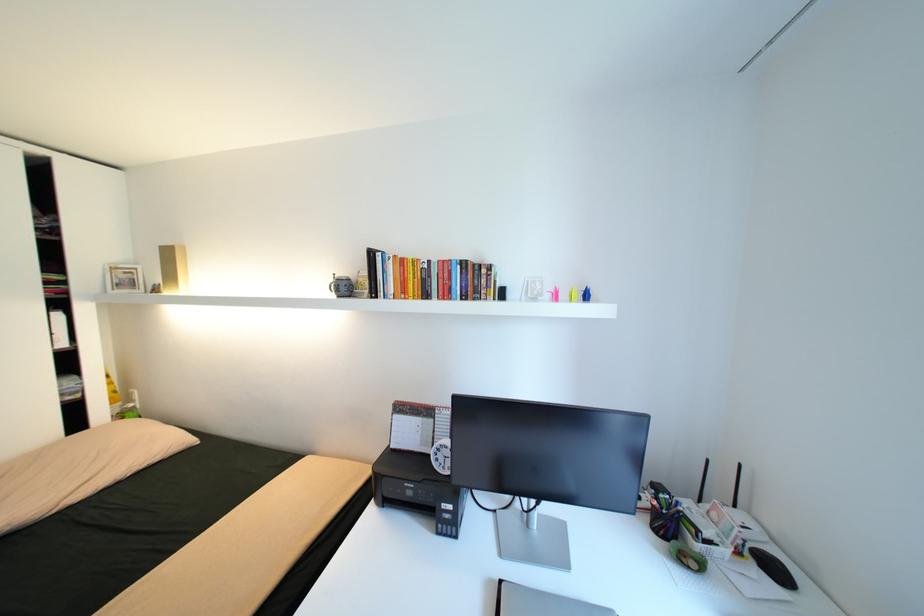
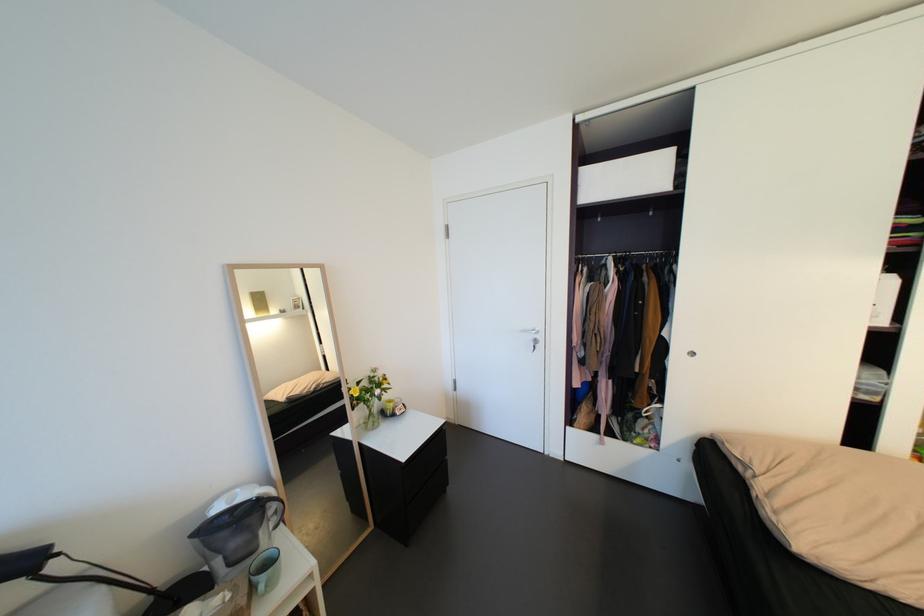
In the second image, find the point that corresponds to pixel 66 315 in the first image.

(900, 278)